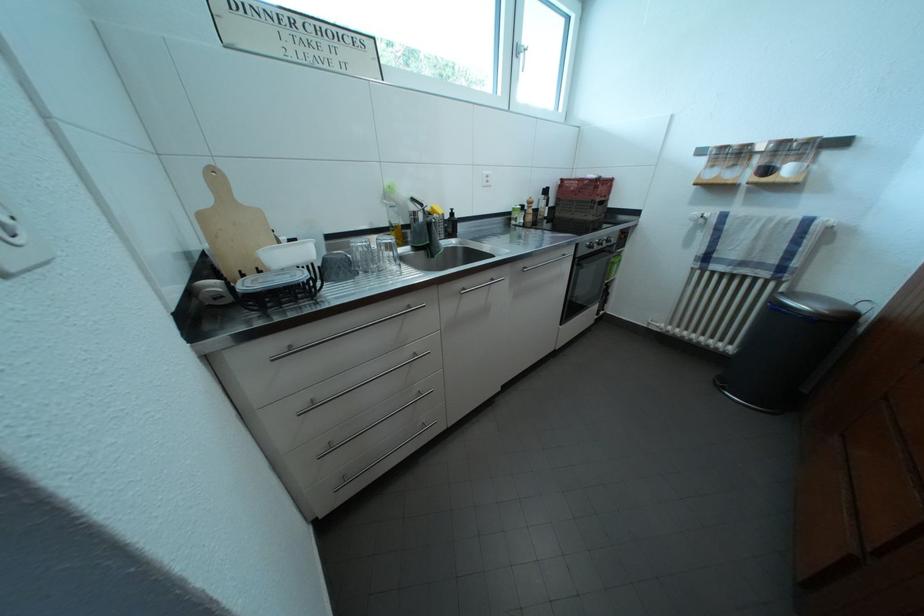
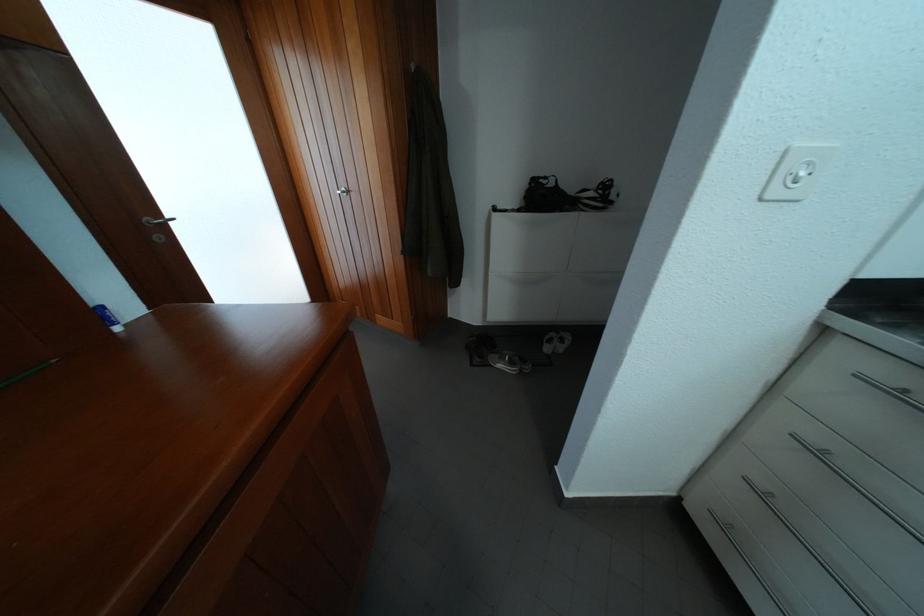
Where in the second image is the point corresponding to (300,357) from the first image?

(906, 400)